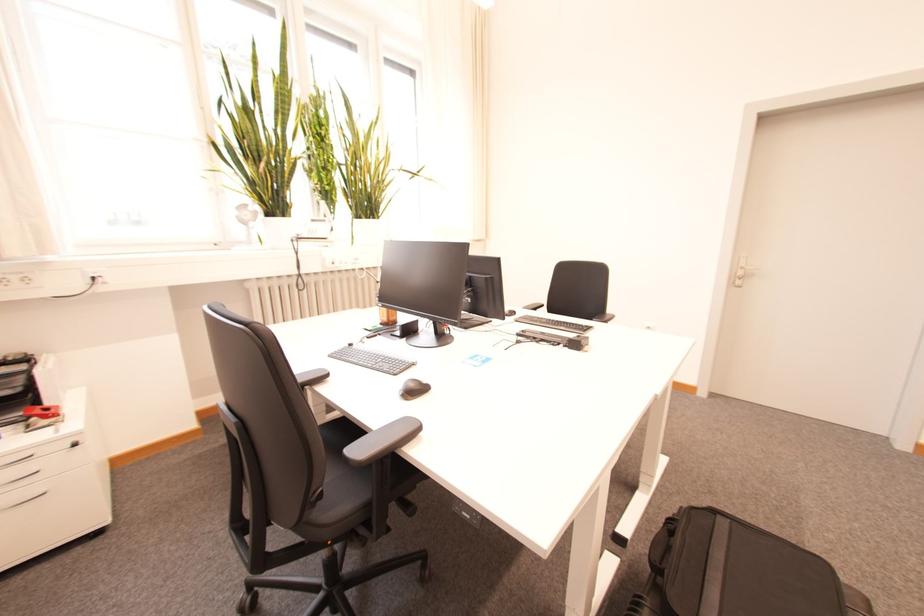
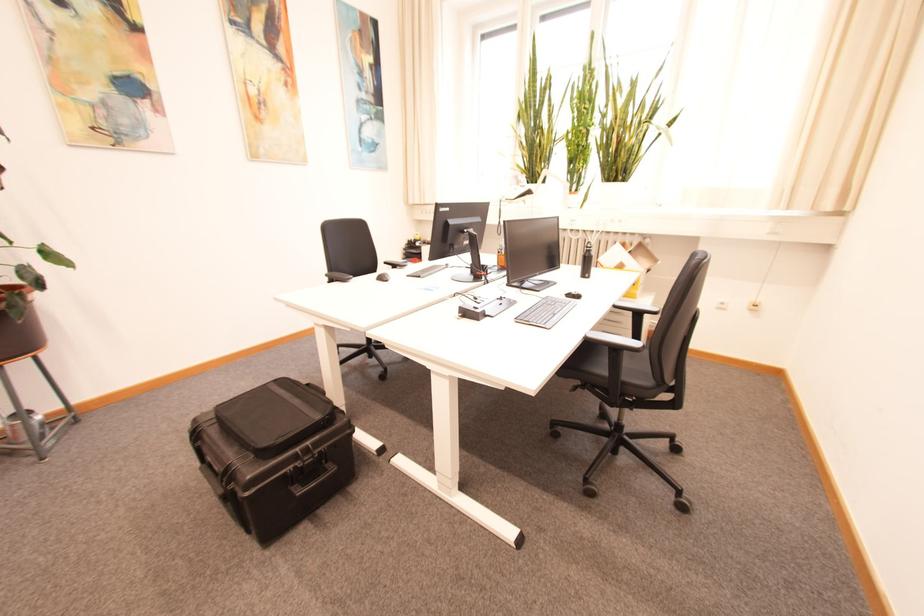
In the second image, find the point that corresponds to [671,492] in the first image.

(463, 519)